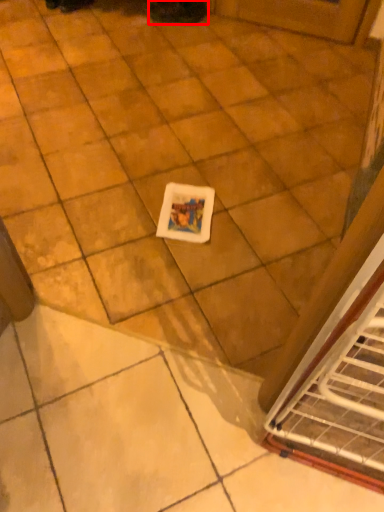
Question: From the image's perspective, what is the correct spatial relationship of footwear (annotated by the red box) in relation to ceramic tile?

Choices:
 (A) below
 (B) above

Answer: (B)